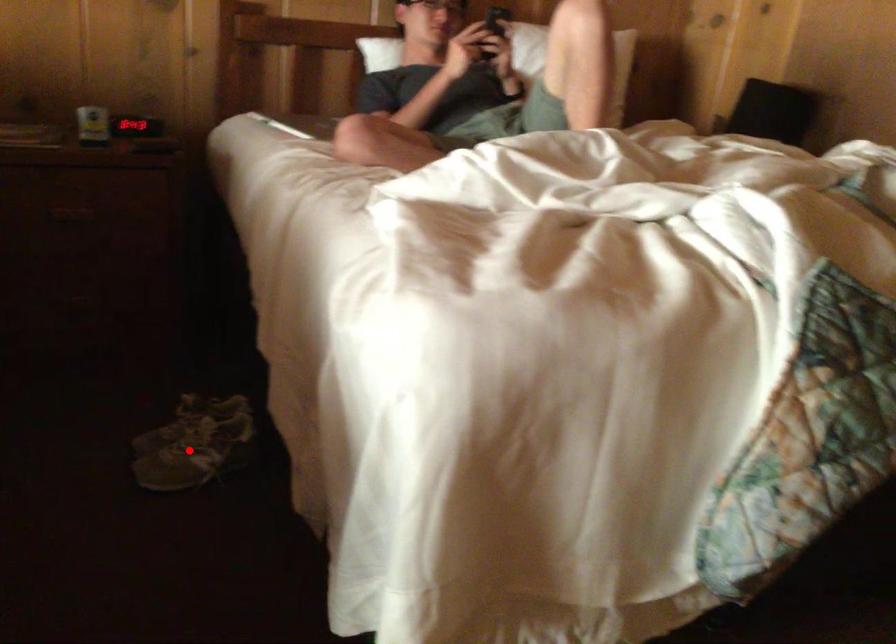
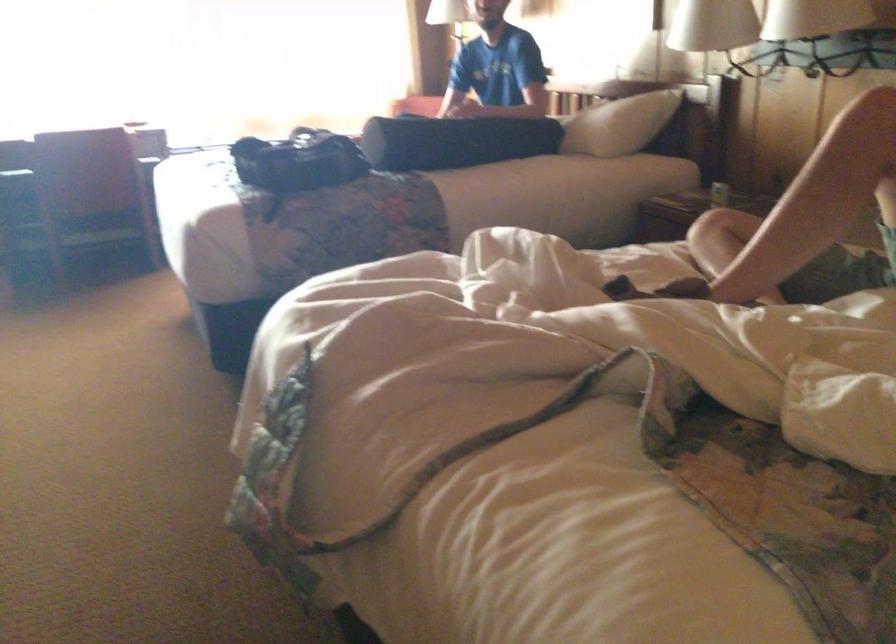
Question: I am providing you with two images of the same scene from different viewpoints. A red point is marked on the first image. Can you still see the location of the red point in image 2?

Choices:
 (A) Yes
 (B) No

Answer: (B)